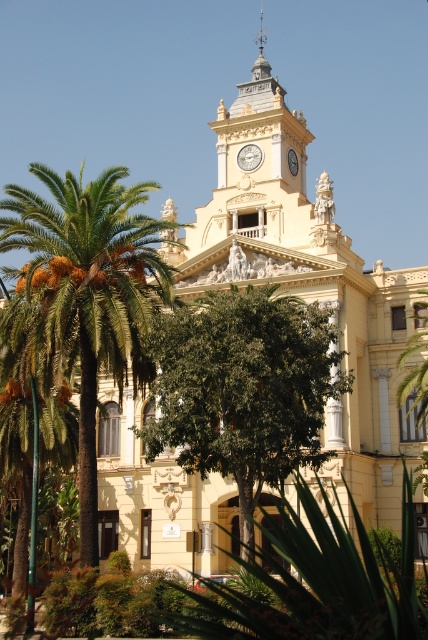
From the picture: Can you confirm if green leafy tree at center is smaller than green leafy palm tree at left?

Correct, green leafy tree at center occupies less space than green leafy palm tree at left.

Is the position of green leafy tree at center more distant than that of green leafy palm tree at left?

No, green leafy tree at center is in front of green leafy palm tree at left.

Does point (338, 396) come farther from viewer compared to point (142, 369)?

No.

The width and height of the screenshot is (428, 640). Identify the location of green leafy tree at center. (243, 388).

Who is positioned more to the right, green leafy tree at center or white glossy clock at upper center?

From the viewer's perspective, white glossy clock at upper center appears more on the right side.

The height and width of the screenshot is (640, 428). In order to click on green leafy tree at center in this screenshot , I will do `click(243, 388)`.

Based on the photo, is green leafy palm tree at left positioned in front of white glossy clock at upper center?

Yes, green leafy palm tree at left is closer to the viewer.

Which is behind, point (130, 272) or point (240, 157)?

Positioned behind is point (240, 157).

You are a GUI agent. You are given a task and a screenshot of the screen. Output one action in this format:
    pyautogui.click(x=<x>, y=<y>)
    Task: Click on the green leafy palm tree at left
    This screenshot has width=428, height=640.
    Given the screenshot: What is the action you would take?
    pyautogui.click(x=89, y=291)